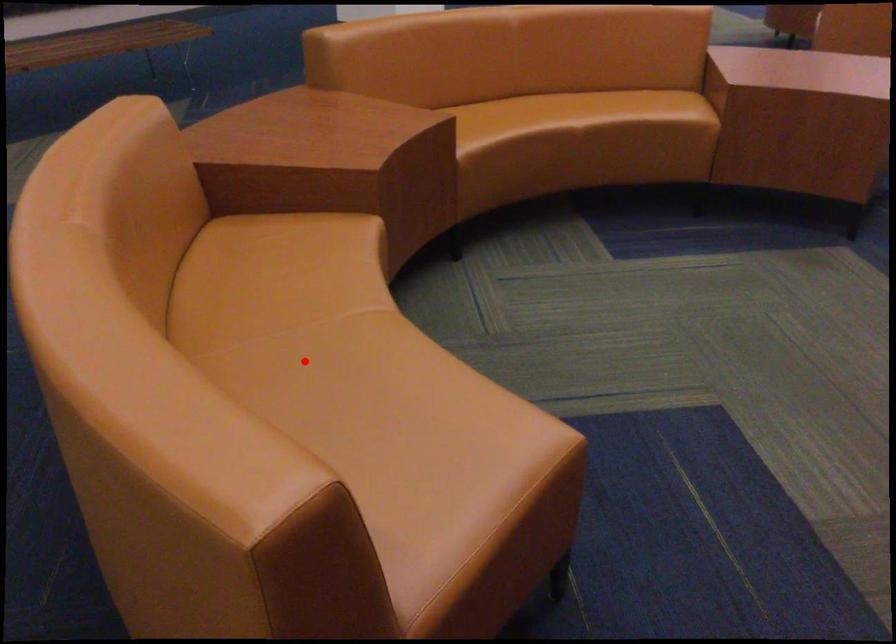
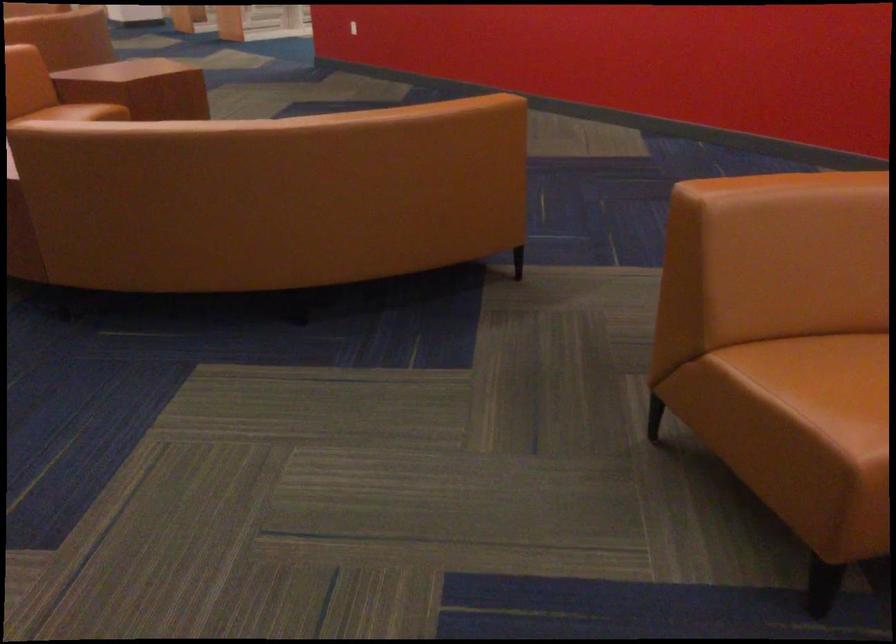
Question: I am providing you with two images of the same scene from different viewpoints. A red point is marked on the first image. Can you still see the location of the red point in image 2?

Choices:
 (A) Yes
 (B) No

Answer: (B)